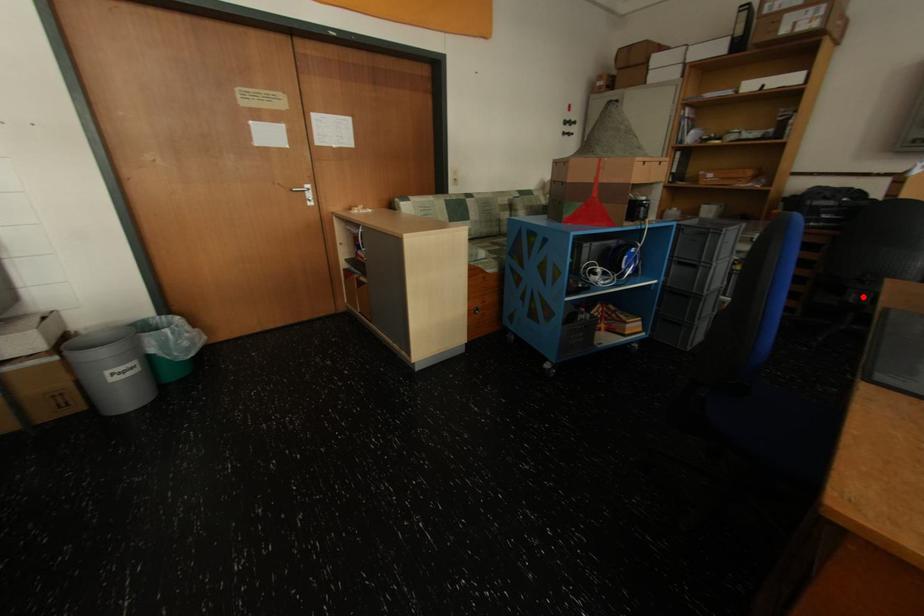
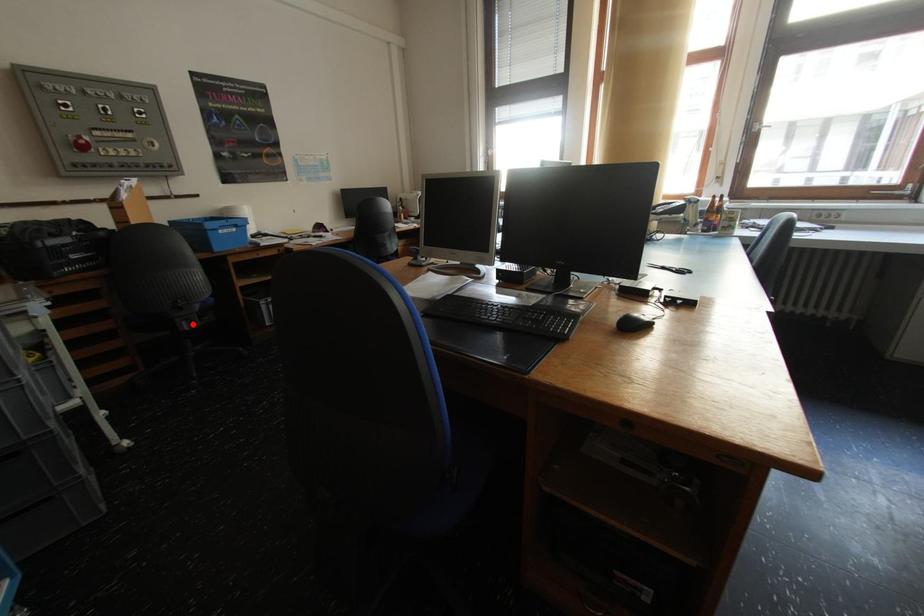
Based on the photo, I am providing you with two images of the same scene from different viewpoints. A red point is marked on the first image and another point is marked on the second image. Is the marked point in image1 the same physical position as the marked point in image2?

Yes